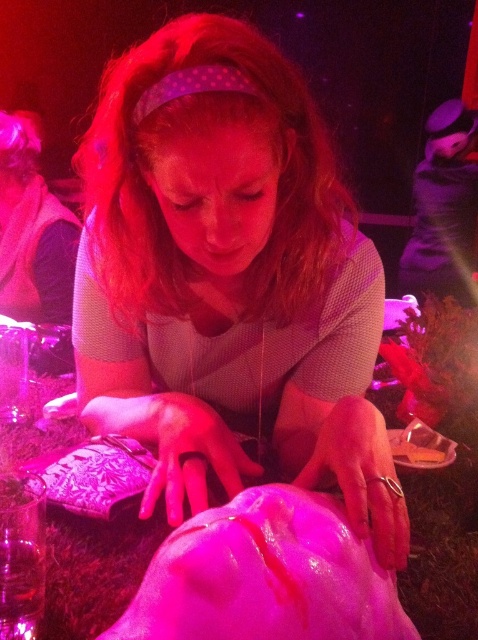
Is point (354, 392) less distant than point (34, 451)?

That is True.

Which of these two, matte pink fabric at center or pink fabric table at center, stands taller?

matte pink fabric at center is taller.

Is point (145, 113) more distant than point (66, 564)?

No.

What are the coordinates of `matte pink fabric at center` in the screenshot? It's located at (228, 276).